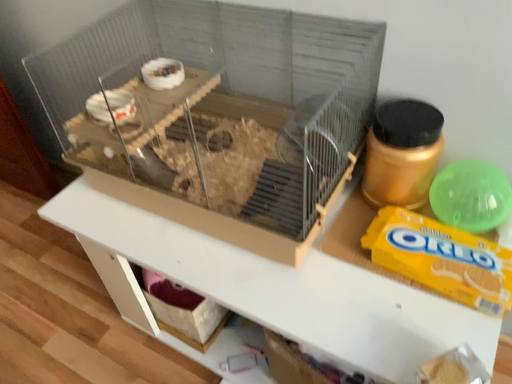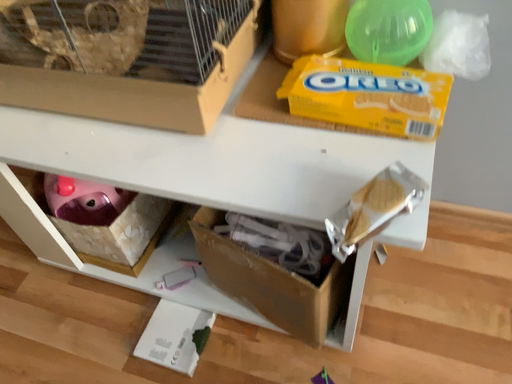
Question: How did the camera likely rotate when shooting the video?

Choices:
 (A) rotated left
 (B) rotated right

Answer: (B)